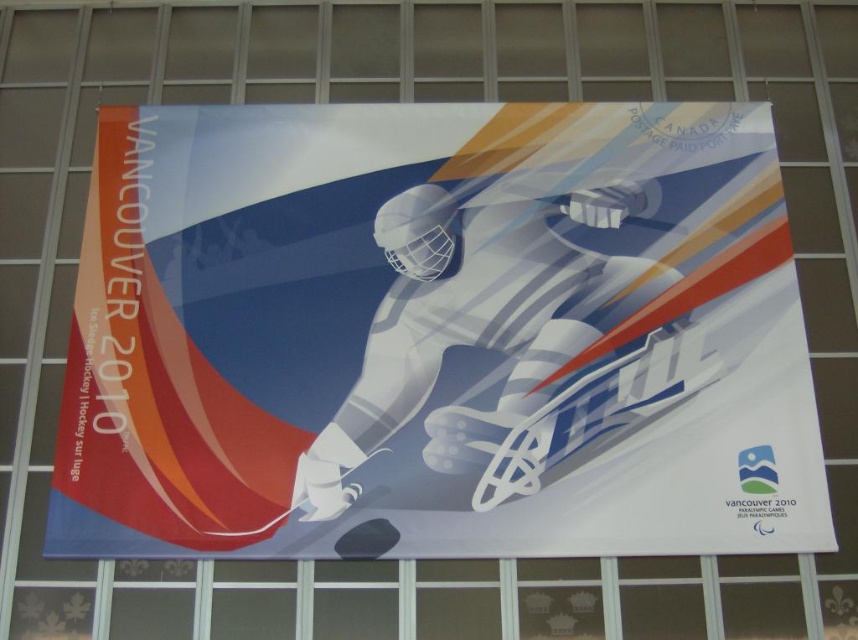
You are standing in front of the Vancouver Winter Olympics 2010 promotional banner. You notice two points marked on the banner. The first point is at coordinates point [446,157], and the second is at point [405,234]. From your perspective, which point is closer to you?

Point [405,234] is closer to you because the description states that point [446,157] is behind point [405,234].

You are an art critic observing the promotional banner for the 2010 Winter Olympics. You notice two central figures, the matte white hockey player at center and the white glossy astronaut at center. Which figure appears closer to the viewer?

The matte white hockey player at center is in front of the white glossy astronaut at center, so the matte white hockey player at center appears closer to the viewer.